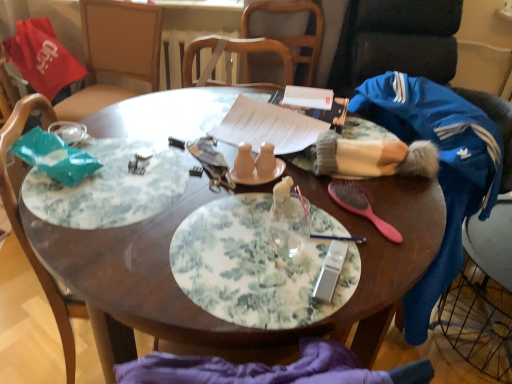
Where is `free space above wooden table at center (from a real-world perspective)`? The height and width of the screenshot is (384, 512). free space above wooden table at center (from a real-world perspective) is located at coordinates (x=221, y=188).